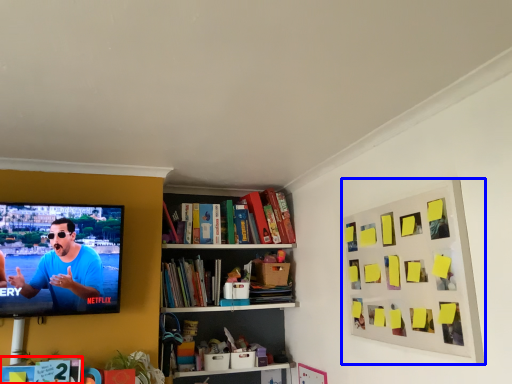
Question: Which object appears closest to the camera in this image, book (highlighted by a red box) or picture frame (highlighted by a blue box)?

Choices:
 (A) book
 (B) picture frame

Answer: (B)